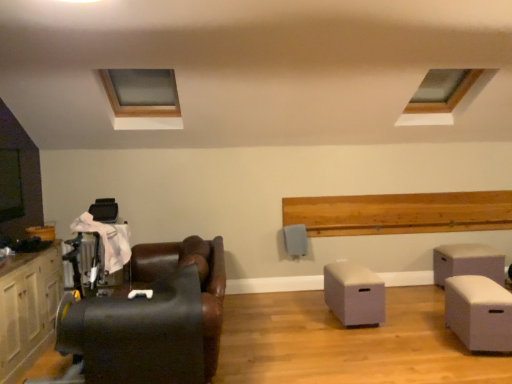
Question: Does black leather chair at left have a greater width compared to white matte storage box at center, acting as the 2th table starting from the back?

Choices:
 (A) no
 (B) yes

Answer: (B)

Question: Is white matte storage box at center, acting as the second table starting from the front, completely or partially inside black leather chair at left?

Choices:
 (A) no
 (B) yes

Answer: (A)

Question: Considering the relative sizes of black leather chair at left and white matte storage box at center, marked as the first table in a left-to-right arrangement, in the image provided, is black leather chair at left shorter than white matte storage box at center, marked as the first table in a left-to-right arrangement,?

Choices:
 (A) no
 (B) yes

Answer: (A)

Question: Is black leather chair at left not close to white matte storage box at center, arranged as the third table when viewed from the right?

Choices:
 (A) yes
 (B) no

Answer: (A)

Question: From a real-world perspective, does black leather chair at left stand above white matte storage box at center, marked as the first table in a left-to-right arrangement?

Choices:
 (A) yes
 (B) no

Answer: (A)

Question: Is the position of black leather chair at left more distant than that of white matte storage box at center, acting as the second table starting from the front?

Choices:
 (A) no
 (B) yes

Answer: (A)

Question: Is there a large distance between matte white cabinet at left and wooden frame at upper left?

Choices:
 (A) yes
 (B) no

Answer: (A)

Question: Does matte white cabinet at left lie in front of wooden frame at upper left?

Choices:
 (A) no
 (B) yes

Answer: (B)

Question: Is matte white cabinet at left to the right of wooden frame at upper left from the viewer's perspective?

Choices:
 (A) no
 (B) yes

Answer: (A)

Question: Is matte white cabinet at left in contact with wooden frame at upper left?

Choices:
 (A) yes
 (B) no

Answer: (B)

Question: Can we say matte white cabinet at left lies outside wooden frame at upper left?

Choices:
 (A) no
 (B) yes

Answer: (B)

Question: From the image's perspective, does matte white cabinet at left appear lower than wooden frame at upper left?

Choices:
 (A) no
 (B) yes

Answer: (B)

Question: Is white matte storage box at lower right, the 2th table from the left, placed right next to black leather chair at left?

Choices:
 (A) no
 (B) yes

Answer: (A)